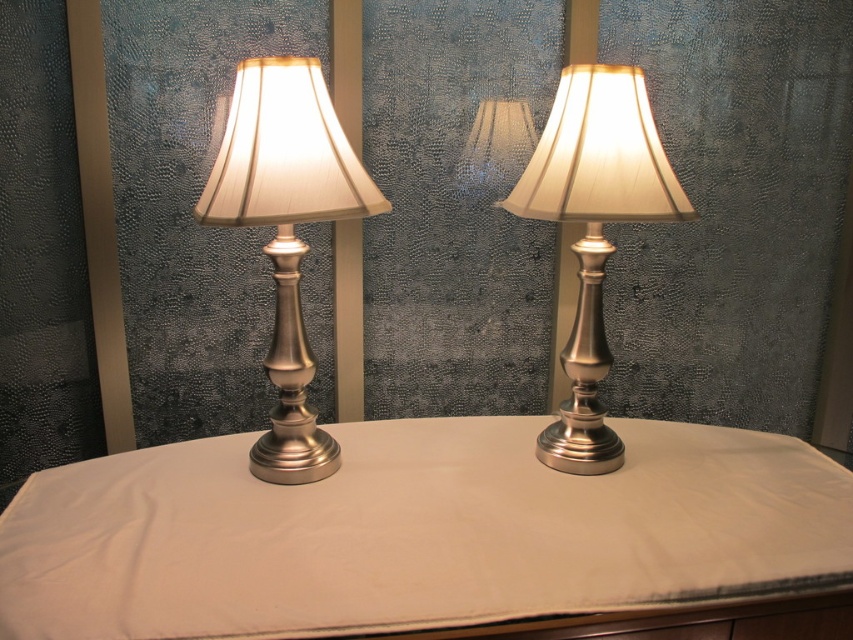
Question: Among these points, which one is farthest from the camera?

Choices:
 (A) (274, 168)
 (B) (627, 74)

Answer: (B)

Question: Does white fabric table at center appear on the right side of brushed metal table lamp at center?

Choices:
 (A) no
 (B) yes

Answer: (A)

Question: Based on their relative distances, which object is nearer to the white fabric table at center?

Choices:
 (A) brushed metal table lamp at center
 (B) satin silver table lamp at left

Answer: (B)

Question: Which of the following is the closest to the observer?

Choices:
 (A) white fabric table at center
 (B) satin silver table lamp at left

Answer: (A)

Question: Considering the relative positions of white fabric table at center and satin silver table lamp at left in the image provided, where is white fabric table at center located with respect to satin silver table lamp at left?

Choices:
 (A) left
 (B) right

Answer: (B)

Question: Considering the relative positions of satin silver table lamp at left and brushed metal table lamp at center in the image provided, where is satin silver table lamp at left located with respect to brushed metal table lamp at center?

Choices:
 (A) left
 (B) right

Answer: (A)